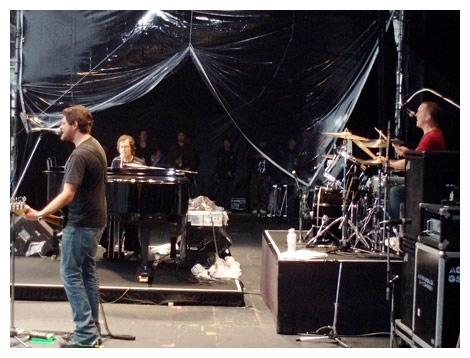
At what (x,y) coordinates should I click in order to perform the action: click on piano. Please return your answer as a coordinate pair (x, y). This screenshot has width=470, height=358. Looking at the image, I should click on (133, 199).